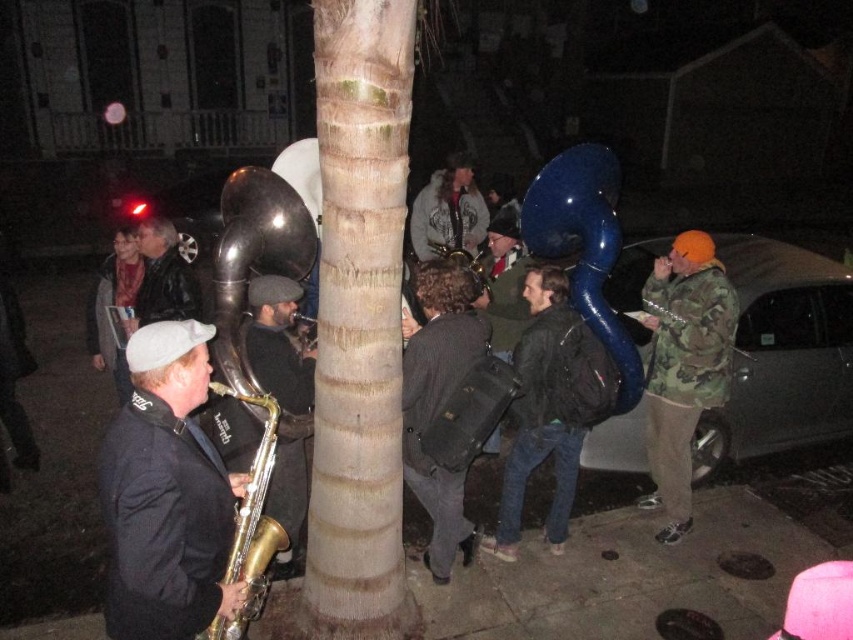
Between dark gray fabric backpack at center and gold brass saxophone at left, which one is positioned lower?

gold brass saxophone at left

Based on the photo, who is positioned more to the left, dark gray fabric backpack at center or gold brass saxophone at left?

Positioned to the left is gold brass saxophone at left.

Which is behind, point (428, 557) or point (256, 460)?

The point (428, 557) is more distant.

This screenshot has width=853, height=640. I want to click on dark gray fabric backpack at center, so click(x=438, y=401).

Who is positioned more to the right, smooth bark tree trunk at center or shiny silver saxophone at center?

shiny silver saxophone at center is more to the right.

Is smooth bark tree trunk at center bigger than shiny silver saxophone at center?

Indeed, smooth bark tree trunk at center has a larger size compared to shiny silver saxophone at center.

Is point (407, 96) in front of point (430, 214)?

Yes.

You are a GUI agent. You are given a task and a screenshot of the screen. Output one action in this format:
    pyautogui.click(x=<x>, y=<y>)
    Task: Click on the smooth bark tree trunk at center
    The height and width of the screenshot is (640, 853).
    Given the screenshot: What is the action you would take?
    pyautogui.click(x=358, y=323)

Can you confirm if smooth bark tree trunk at center is positioned to the right of black leather jacket at center?

Incorrect, smooth bark tree trunk at center is not on the right side of black leather jacket at center.

Locate an element on the screen. Image resolution: width=853 pixels, height=640 pixels. smooth bark tree trunk at center is located at coordinates (358, 323).